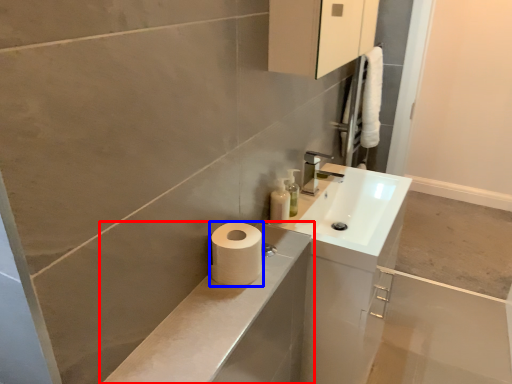
Question: Which object is closer to the camera taking this photo, bathroom cabinet (highlighted by a red box) or toilet paper (highlighted by a blue box)?

Choices:
 (A) bathroom cabinet
 (B) toilet paper

Answer: (A)